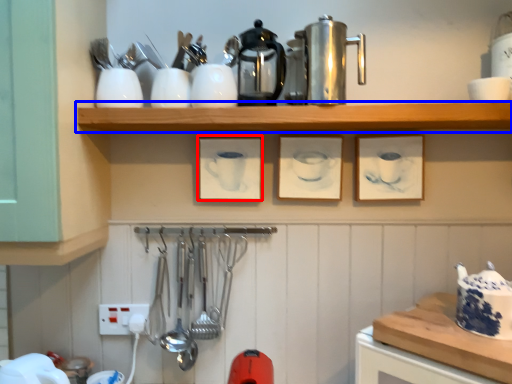
Question: Which of the following is the closest to the observer, picture frame (highlighted by a red box) or shelf (highlighted by a blue box)?

Choices:
 (A) picture frame
 (B) shelf

Answer: (B)